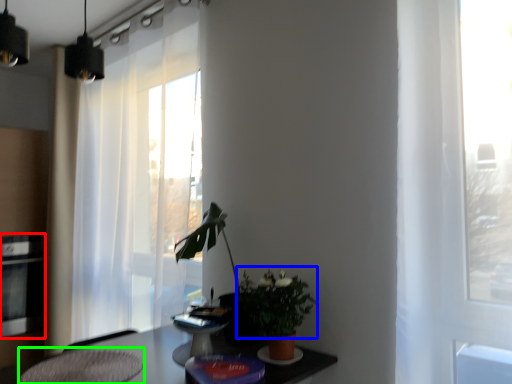
Question: Considering the real-world distances, which object is closest to appliance (highlighted by a red box)? floral arrangement (highlighted by a blue box) or swivel chair (highlighted by a green box).

Choices:
 (A) floral arrangement
 (B) swivel chair

Answer: (B)